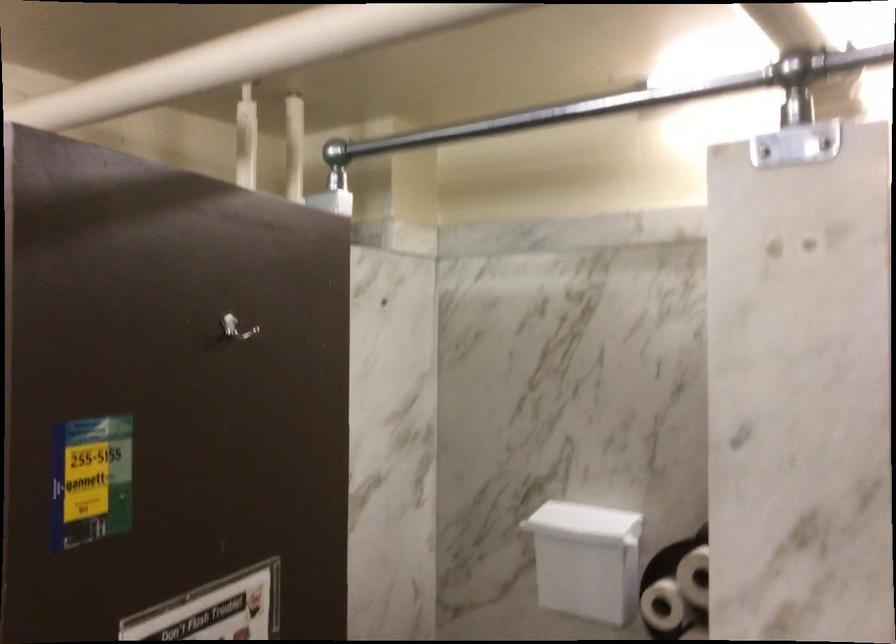
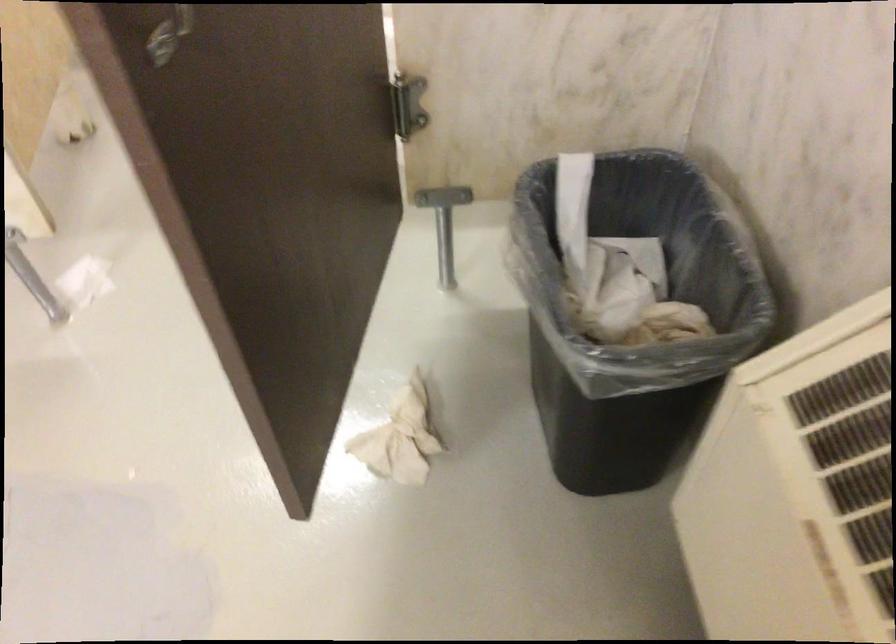
The first image is from the beginning of the video and the second image is from the end. How did the camera likely rotate when shooting the video?

The camera's rotation is toward right-down.